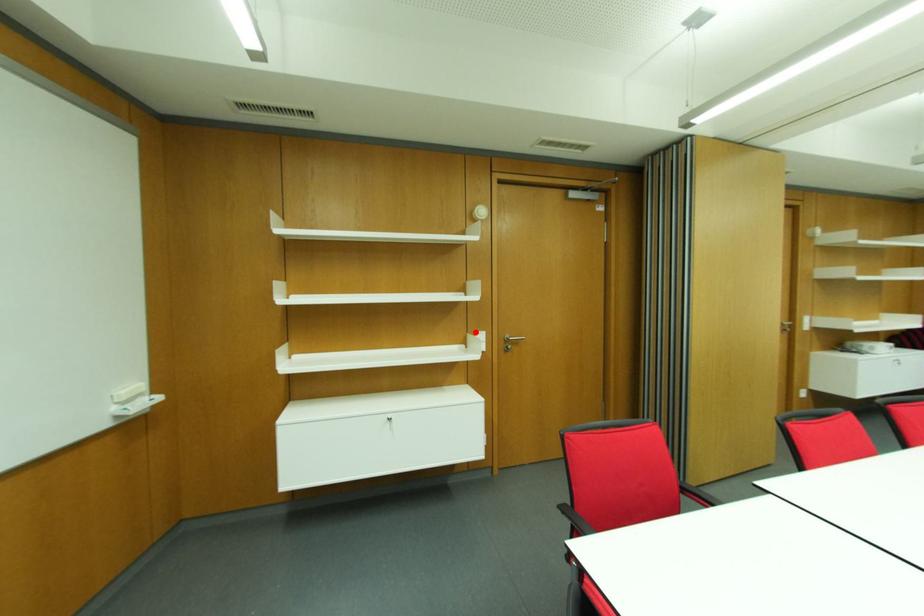
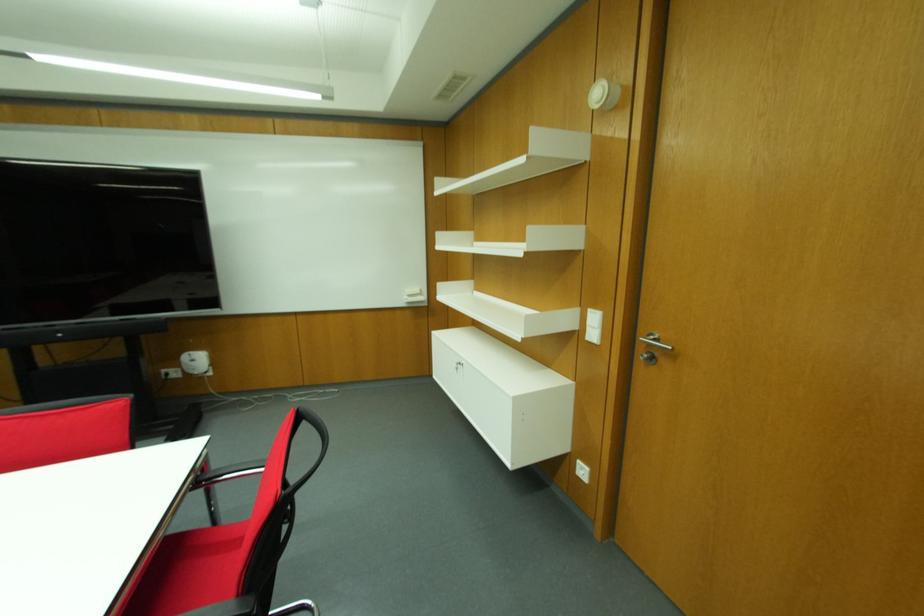
Find the pixel in the second image that matches the highlighted location in the first image.

(589, 310)